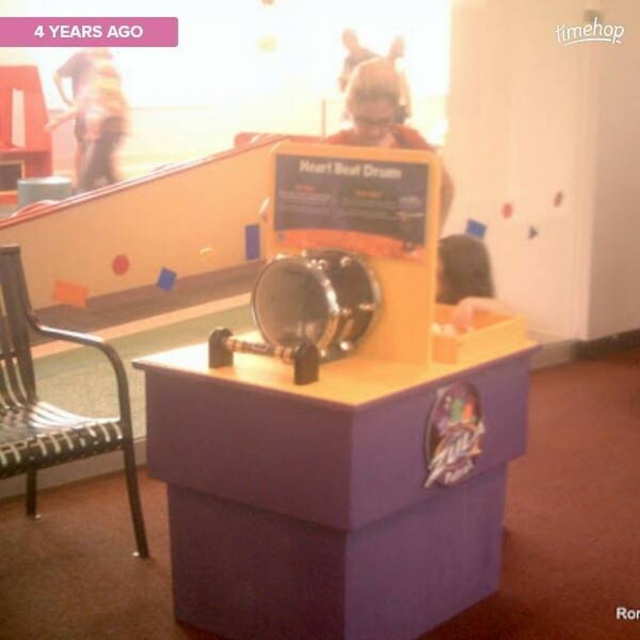
Who is higher up, purple wood table at center or metallic woven chair at left?

metallic woven chair at left is above.

Does purple wood table at center have a lesser width compared to metallic woven chair at left?

No, purple wood table at center is not thinner than metallic woven chair at left.

Who is more distant from viewer, (205, 419) or (33, 490)?

Point (33, 490)

The height and width of the screenshot is (640, 640). Identify the location of purple wood table at center. (332, 488).